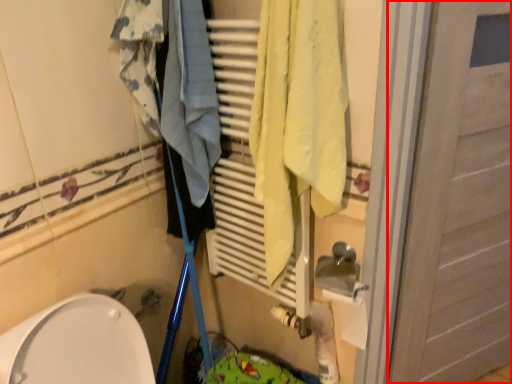
Question: From the image's perspective, where is door (annotated by the red box) located in relation to clothing in the image?

Choices:
 (A) below
 (B) above

Answer: (A)